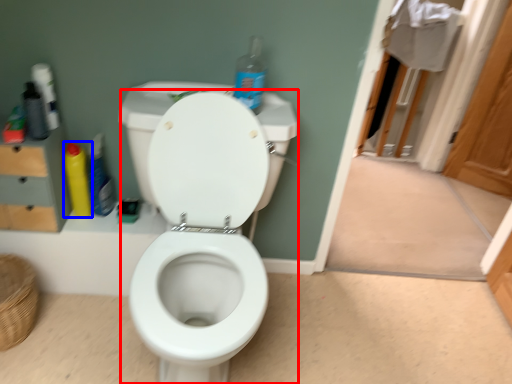
Question: Which object appears closest to the camera in this image, toilet (highlighted by a red box) or cleaning product (highlighted by a blue box)?

Choices:
 (A) toilet
 (B) cleaning product

Answer: (A)